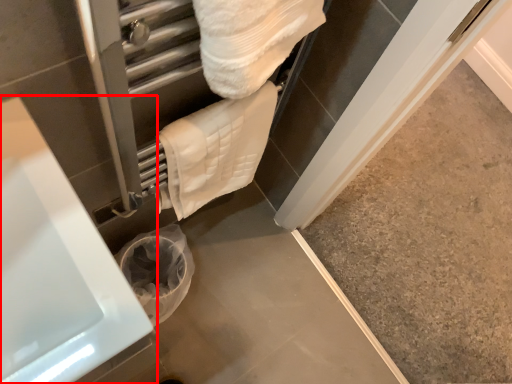
Question: Considering the relative positions of bath (annotated by the red box) and towel in the image provided, where is bath (annotated by the red box) located with respect to the staircase?

Choices:
 (A) left
 (B) right

Answer: (A)